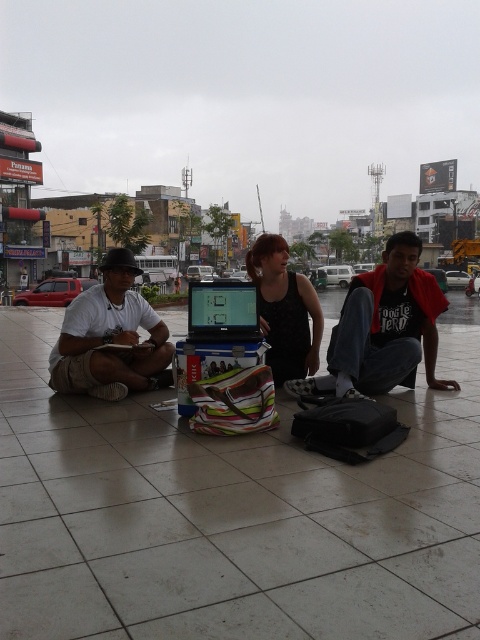
Between white matte shirt at center and black matte tank top at center, which one is positioned lower?

Positioned lower is white matte shirt at center.

Does white matte shirt at center appear over black matte tank top at center?

Actually, white matte shirt at center is below black matte tank top at center.

Between point (127, 374) and point (276, 269), which one is positioned behind?

The point (276, 269) is behind.

This screenshot has width=480, height=640. I want to click on white matte shirt at center, so click(110, 337).

From the picture: Can you confirm if white matte shirt at center is taller than black plastic laptop at center?

Yes.

Identify the location of white matte shirt at center. (110, 337).

I want to click on white matte shirt at center, so click(x=110, y=337).

Who is lower down, dark red cotton shirt at lower right or black matte tank top at center?

dark red cotton shirt at lower right is lower down.

Who is positioned more to the left, dark red cotton shirt at lower right or black matte tank top at center?

From the viewer's perspective, black matte tank top at center appears more on the left side.

Is point (388, 362) more distant than point (286, 284)?

No, (388, 362) is closer to viewer.

Where is `dark red cotton shirt at lower right`? This screenshot has height=640, width=480. dark red cotton shirt at lower right is located at coordinates (387, 323).